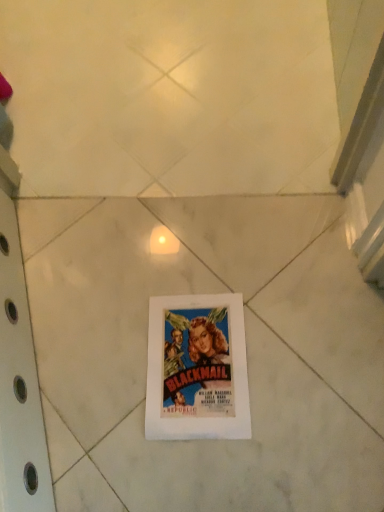
Identify the location of vacant space in white paper at center (from a real-world perspective). The height and width of the screenshot is (512, 384). (203, 362).